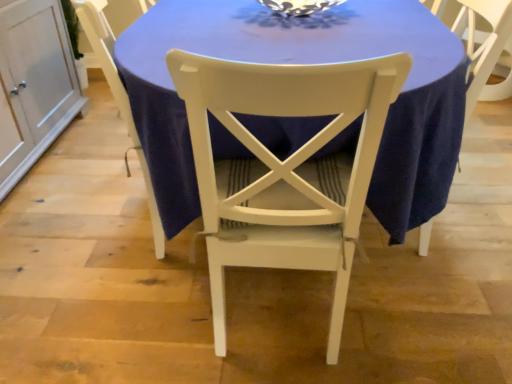
Question: Based on their sizes in the image, would you say white painted wood chair at center, acting as the 2th chair starting from the right, is bigger or smaller than blue fabric table at center?

Choices:
 (A) big
 (B) small

Answer: (B)

Question: Considering their positions, is white painted wood chair at center, which is the first chair in left-to-right order, located in front of or behind blue fabric table at center?

Choices:
 (A) front
 (B) behind

Answer: (B)

Question: Which object is the farthest from the white painted wood chair at center, which is the first chair in left-to-right order?

Choices:
 (A) blue fabric table at center
 (B) white painted wood chair at center, positioned as the 1th chair in right-to-left order
 (C) white wood cabinet at left

Answer: (C)

Question: Based on their relative distances, which object is farther from the white painted wood chair at center, arranged as the second chair when viewed from the left?

Choices:
 (A) white painted wood chair at center, acting as the 2th chair starting from the right
 (B) blue fabric table at center
 (C) white wood cabinet at left

Answer: (C)